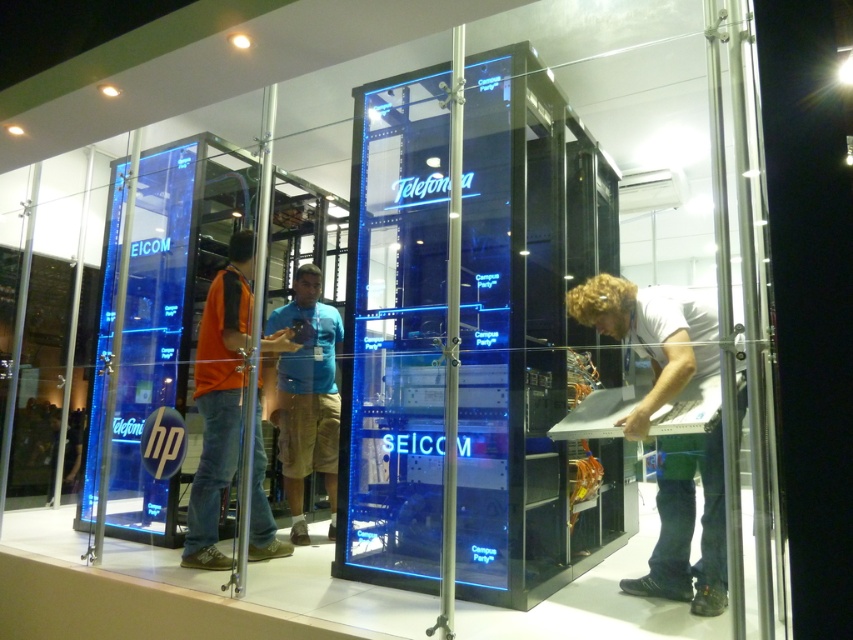
Does orange fabric shirt at center have a greater height compared to blue fabric shirt at center?

Yes.

In the scene shown: Measure the distance between orange fabric shirt at center and blue fabric shirt at center.

orange fabric shirt at center and blue fabric shirt at center are 64.44 centimeters apart from each other.

Does point (213, 349) lie in front of point (276, 320)?

That is True.

Find the location of a particular element. The width and height of the screenshot is (853, 640). orange fabric shirt at center is located at coordinates (219, 400).

Can you confirm if white matte shirt at center is wider than orange fabric shirt at center?

Indeed, white matte shirt at center has a greater width compared to orange fabric shirt at center.

Is point (711, 433) positioned in front of point (233, 417)?

Yes, it is.

Does point (635, 317) come farther from viewer compared to point (242, 252)?

No, it is not.

At what (x,y) coordinates should I click in order to perform the action: click on white matte shirt at center. Please return your answer as a coordinate pair (x, y). This screenshot has width=853, height=640. Looking at the image, I should click on (651, 337).

Is white matte shirt at center in front of blue fabric shirt at center?

That is True.

Does white matte shirt at center have a lesser width compared to blue fabric shirt at center?

No.

I want to click on white matte shirt at center, so click(651, 337).

I want to click on white matte shirt at center, so click(x=651, y=337).